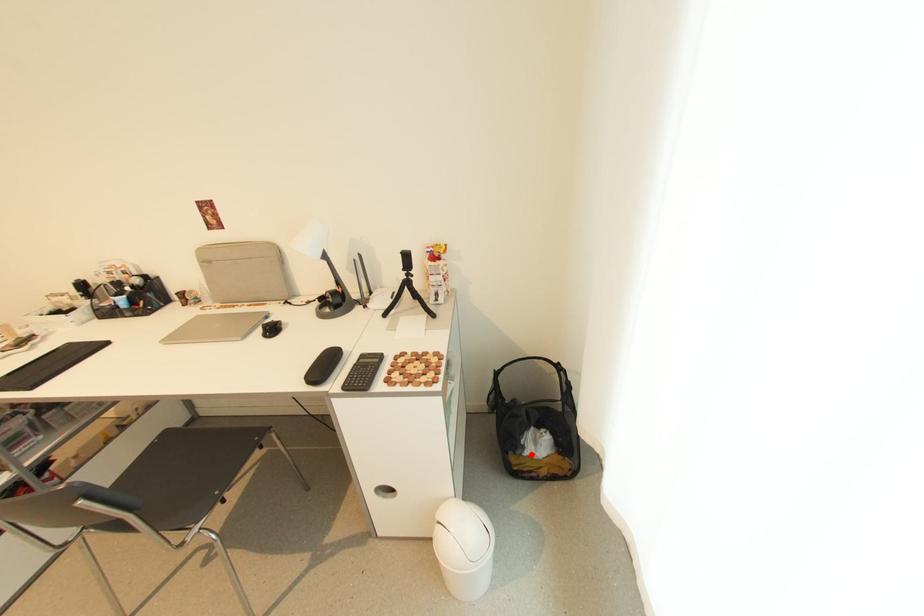
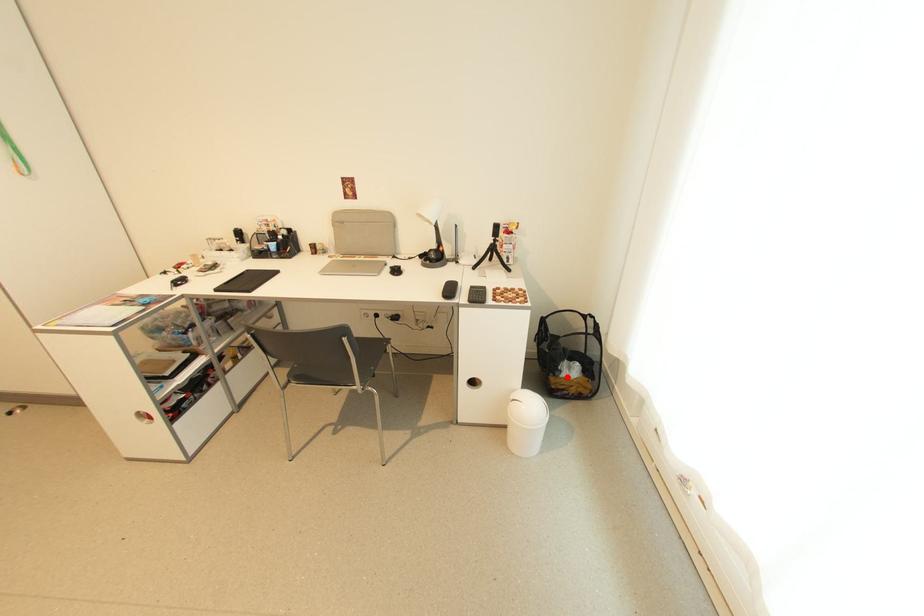
I am providing you with two images of the same scene from different viewpoints. A red point is marked on the first image and another point is marked on the second image. Do the highlighted points in image1 and image2 indicate the same real-world spot?

Yes